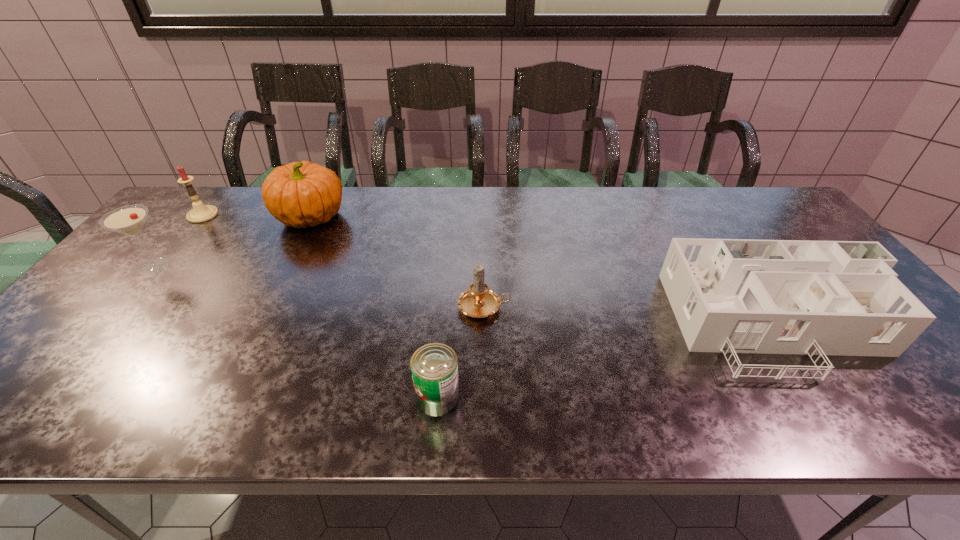
At what (x,y) coordinates should I click in order to perform the action: click on object located in the far left corner section of the desktop. Please return your answer as a coordinate pair (x, y). The width and height of the screenshot is (960, 540). Looking at the image, I should click on (200, 213).

In the image, there is a desktop. Identify the location of vacant space at the far edge. (517, 195).

Locate an element on the screen. The height and width of the screenshot is (540, 960). vacant space at the near edge of the desktop is located at coordinates (745, 410).

The width and height of the screenshot is (960, 540). In order to click on vacant area that lies between the third object from left to right and the martini in this screenshot , I will do pyautogui.click(x=233, y=241).

Image resolution: width=960 pixels, height=540 pixels. In order to click on vacant point located between the can and the pumpkin in this screenshot , I will do `click(374, 307)`.

Identify the location of empty space between the fourth object from right to left and the farther candle. (257, 216).

At what (x,y) coordinates should I click in order to perform the action: click on vacant area between the can and the taller candle. Please return your answer as a coordinate pair (x, y). The image size is (960, 540). Looking at the image, I should click on (321, 306).

Locate an element on the screen. free space between the rightmost object and the can is located at coordinates (611, 360).

This screenshot has height=540, width=960. In order to click on empty location between the can and the martini in this screenshot , I will do `click(297, 332)`.

Where is `free space between the can and the dollhouse`? free space between the can and the dollhouse is located at coordinates (611, 360).